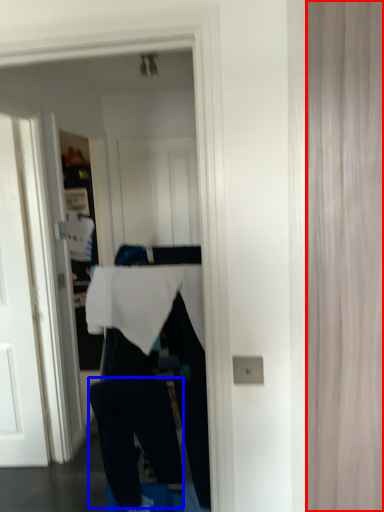
Question: Among these objects, which one is farthest to the camera, curtain (highlighted by a red box) or trousers (highlighted by a blue box)?

Choices:
 (A) curtain
 (B) trousers

Answer: (B)